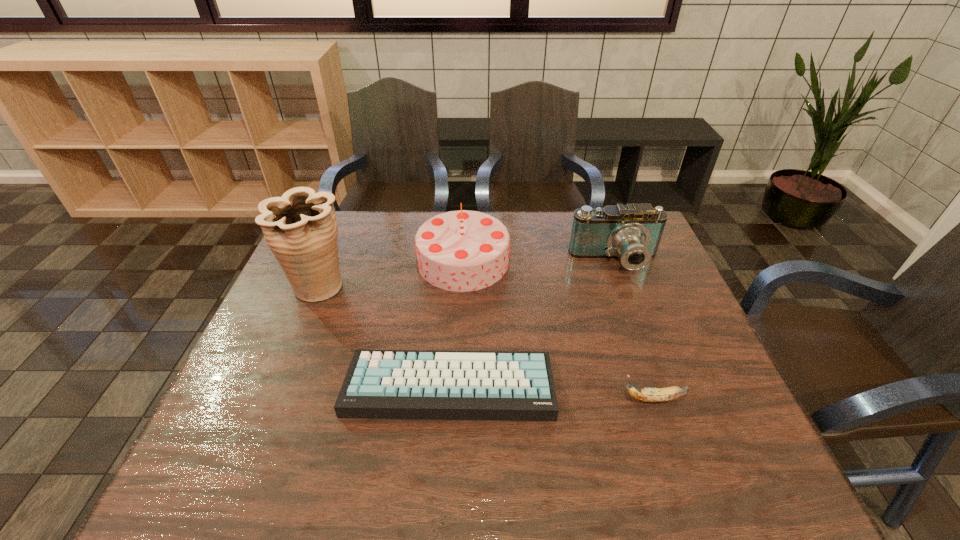
Locate an element on the screen. vacant space in between the birthday cake and the fourth tallest object is located at coordinates (558, 330).

Where is `empty location between the third shortest object and the birthday cake`? The height and width of the screenshot is (540, 960). empty location between the third shortest object and the birthday cake is located at coordinates (540, 261).

Image resolution: width=960 pixels, height=540 pixels. Find the location of `free spot between the fourth tallest object and the birthday cake`. free spot between the fourth tallest object and the birthday cake is located at coordinates (558, 330).

Where is `vacant space that's between the fourth shortest object and the third tallest object`? vacant space that's between the fourth shortest object and the third tallest object is located at coordinates (540, 261).

Identify which object is the second closest to the camcorder. Please provide its 2D coordinates. Your answer should be formatted as a tuple, i.e. [(x, y)], where the tuple contains the x and y coordinates of a point satisfying the conditions above.

[(380, 384)]

Locate which object ranks fourth in proximity to the third shortest object. Please provide its 2D coordinates. Your answer should be formatted as a tuple, i.e. [(x, y)], where the tuple contains the x and y coordinates of a point satisfying the conditions above.

[(300, 228)]

Locate an element on the screen. The image size is (960, 540). free space that satisfies the following two spatial constraints: 1. on the front-facing side of the third tallest object; 2. at the stem of the second shortest object is located at coordinates (665, 399).